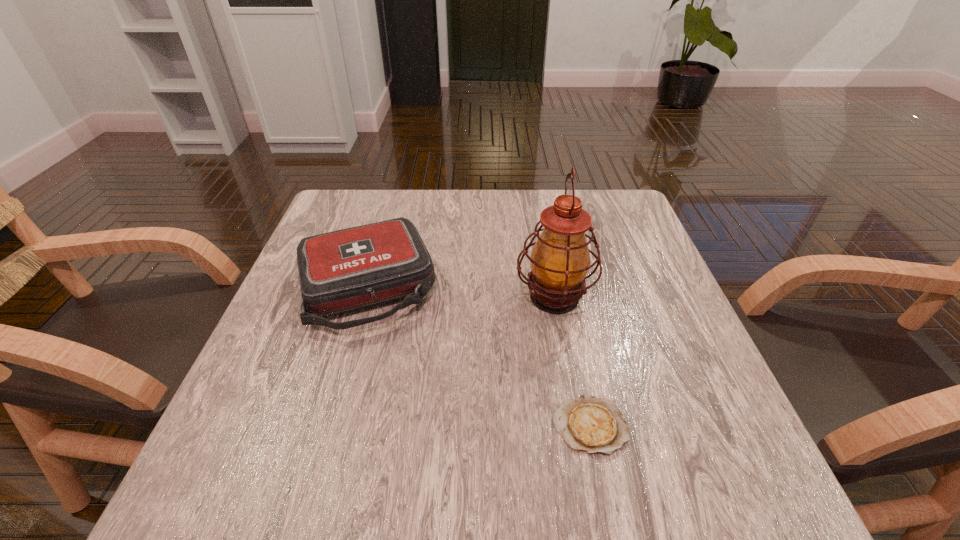
Find the location of a particular element. blank area at the far edge is located at coordinates (522, 191).

Where is `free space at the left edge of the desktop`? The width and height of the screenshot is (960, 540). free space at the left edge of the desktop is located at coordinates (263, 444).

Locate an element on the screen. free spot at the right edge of the desktop is located at coordinates (633, 249).

You are a GUI agent. You are given a task and a screenshot of the screen. Output one action in this format:
    pyautogui.click(x=<x>, y=<y>)
    Task: Click on the free point at the far left corner
    
    Given the screenshot: What is the action you would take?
    pyautogui.click(x=374, y=192)

Find the location of a particular element. The image size is (960, 540). free space at the far right corner of the desktop is located at coordinates (613, 211).

Where is `vacant point at the near right corner`? This screenshot has height=540, width=960. vacant point at the near right corner is located at coordinates (726, 467).

Locate an element on the screen. free point between the leftmost object and the tallest object is located at coordinates (461, 292).

Locate an element on the screen. vacant space that's between the second shortest object and the oil lamp is located at coordinates (461, 292).

Identify the location of empty space that is in between the shortest object and the second tallest object. The width and height of the screenshot is (960, 540). point(478,356).

Image resolution: width=960 pixels, height=540 pixels. In order to click on unoccupied position between the first-aid kit and the shortest object in this screenshot , I will do `click(478, 356)`.